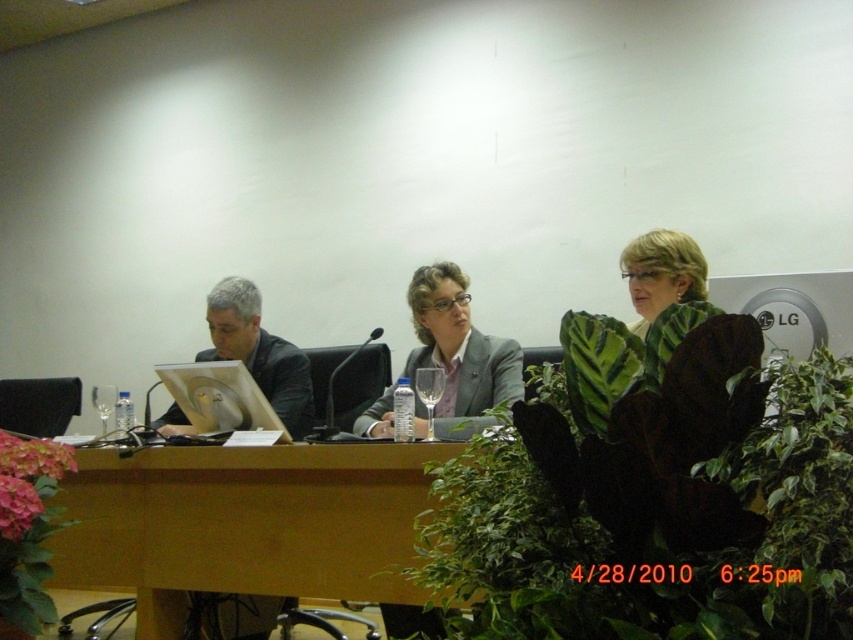
What is the exact coordinate of the brown wood table at center?

The brown wood table at center is located at point [244,524].

What is the color and material of the object located at point coordinates (244, 524)?

The object at coordinates (244, 524) is a brown wood table at center.